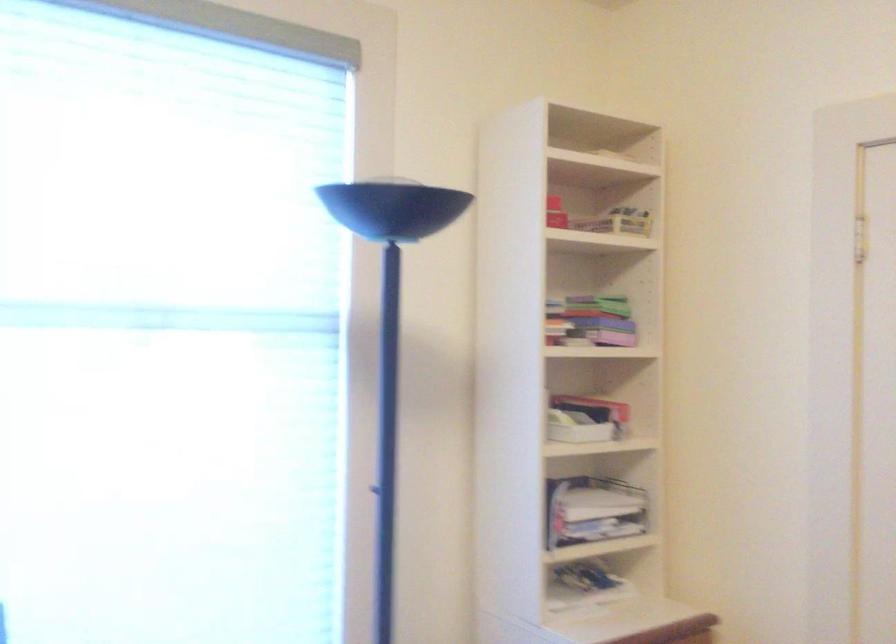
Where is `small white basket`? Image resolution: width=896 pixels, height=644 pixels. small white basket is located at coordinates (576, 428).